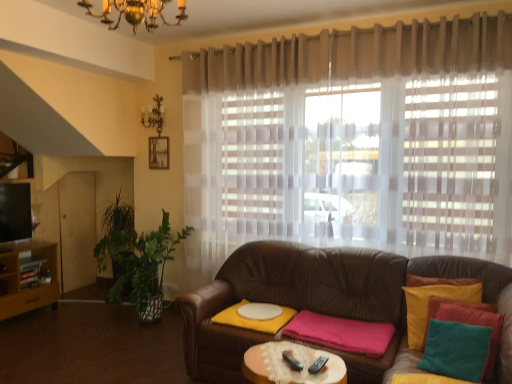
Question: In terms of height, does brown leather couch at center look taller or shorter compared to sheer beige curtain at upper center?

Choices:
 (A) tall
 (B) short

Answer: (B)

Question: Considering the positions of brown leather couch at center and sheer beige curtain at upper center in the image, is brown leather couch at center wider or thinner than sheer beige curtain at upper center?

Choices:
 (A) thin
 (B) wide

Answer: (B)

Question: Is brown leather couch at center in front of or behind sheer beige curtain at upper center in the image?

Choices:
 (A) behind
 (B) front

Answer: (B)

Question: Considering the positions of sheer beige curtain at upper center and brown leather couch at center in the image, is sheer beige curtain at upper center bigger or smaller than brown leather couch at center?

Choices:
 (A) big
 (B) small

Answer: (B)

Question: From the image's perspective, is sheer beige curtain at upper center positioned above or below brown leather couch at center?

Choices:
 (A) below
 (B) above

Answer: (B)

Question: Is sheer beige curtain at upper center taller or shorter than brown leather couch at center?

Choices:
 (A) tall
 (B) short

Answer: (A)

Question: In the image, is sheer beige curtain at upper center positioned in front of or behind brown leather couch at center?

Choices:
 (A) behind
 (B) front

Answer: (A)